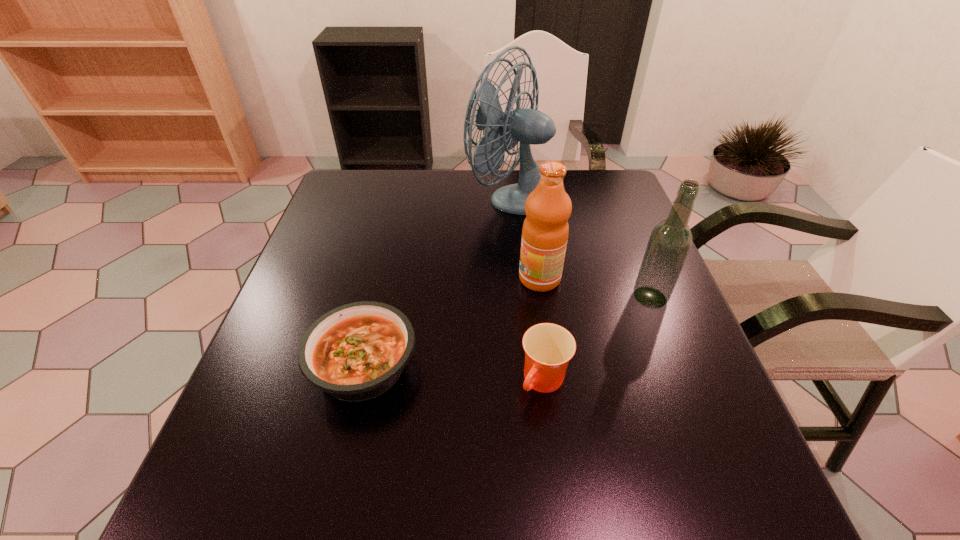
This screenshot has width=960, height=540. Find the location of `fan`. fan is located at coordinates (529, 126).

Image resolution: width=960 pixels, height=540 pixels. I want to click on the farthest object, so click(x=529, y=126).

I want to click on fruit juice, so click(x=545, y=231).

I want to click on the rightmost object, so pos(670,241).

I want to click on the second shortest object, so click(548, 347).

Identify the location of the leftmost object. (356, 352).

Locate an element on the screen. Image resolution: width=960 pixels, height=540 pixels. stew is located at coordinates (356, 352).

Where is `vacant space located in front of the tallest object to blow air`? The width and height of the screenshot is (960, 540). vacant space located in front of the tallest object to blow air is located at coordinates (440, 197).

Image resolution: width=960 pixels, height=540 pixels. What are the coordinates of `vacant point located 0.160m in front of the tallest object to blow air` in the screenshot? It's located at (412, 197).

Where is `vacant space situated 0.360m in front of the tallest object to blow air`? This screenshot has height=540, width=960. vacant space situated 0.360m in front of the tallest object to blow air is located at coordinates (345, 197).